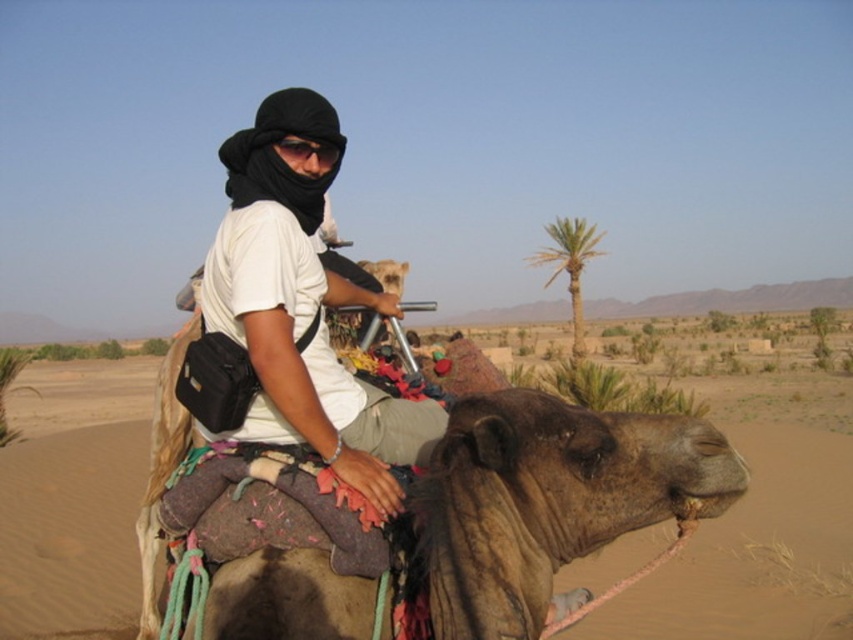
You are a photographer trying to capture the camel rider in the desert scene. The camera is positioned at the point with coordinates point (299, 310). What object is directly in front of the camera?

The point (299, 310) indicates the white matte shirt at center, so the white matte shirt at center is directly in front of the camera.

You are a photographer positioned at the scene. You want to take a photo of the brown textured camel at center and the white matte shirt at center. Given that your camera has a maximum focus range of 35 feet, will both subjects be in focus?

The brown textured camel at center is 37.10 feet away from the white matte shirt at center. Since the camera can only focus up to 35 feet, the distance between them exceeds the focus range. Therefore, both subjects cannot be in focus simultaneously.

You are navigating a desert route and need to locate the green leafy palm tree at upper right. According to the coordinates provided, where exactly is it positioned in the image?

The green leafy palm tree at upper right is located at coordinates point [570,266].